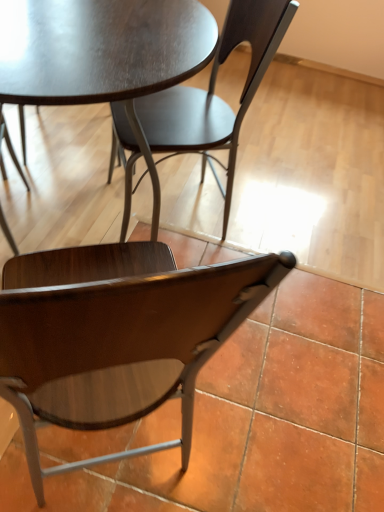
Identify the location of vacant area that is situated to the right of wooden chair at lower center, the second chair in the top-to-bottom sequence. (257, 415).